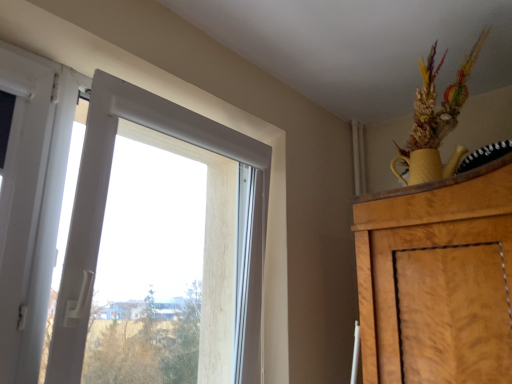
This screenshot has width=512, height=384. What do you see at coordinates (435, 120) in the screenshot? I see `yellow matte teapot at upper right` at bounding box center [435, 120].

What are the coordinates of `yellow matte teapot at upper right` in the screenshot? It's located at (435, 120).

The width and height of the screenshot is (512, 384). I want to click on yellow matte teapot at upper right, so click(435, 120).